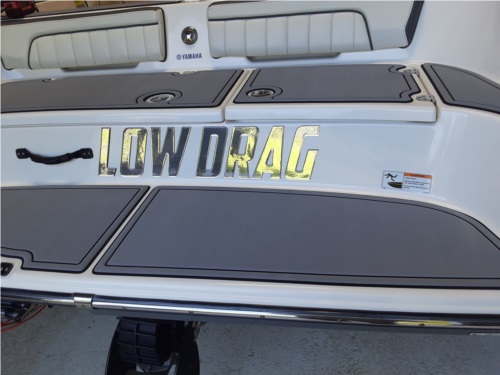
Where is `handle`? handle is located at coordinates (52, 164).